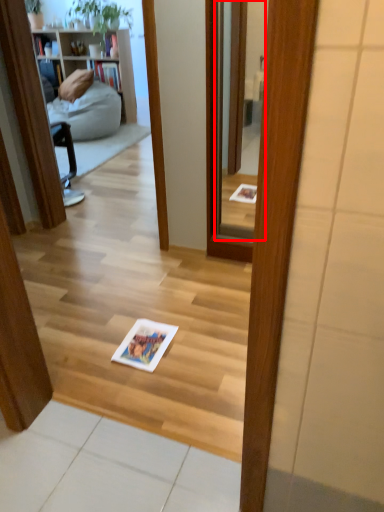
Question: Considering the relative positions of mirror (annotated by the red box) and book in the image provided, where is mirror (annotated by the red box) located with respect to the staircase?

Choices:
 (A) left
 (B) right

Answer: (B)